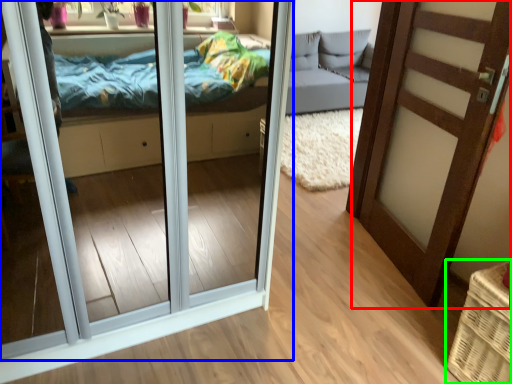
Question: Considering the real-world distances, which object is closest to door (highlighted by a red box)? door (highlighted by a blue box) or basket (highlighted by a green box).

Choices:
 (A) door
 (B) basket

Answer: (B)